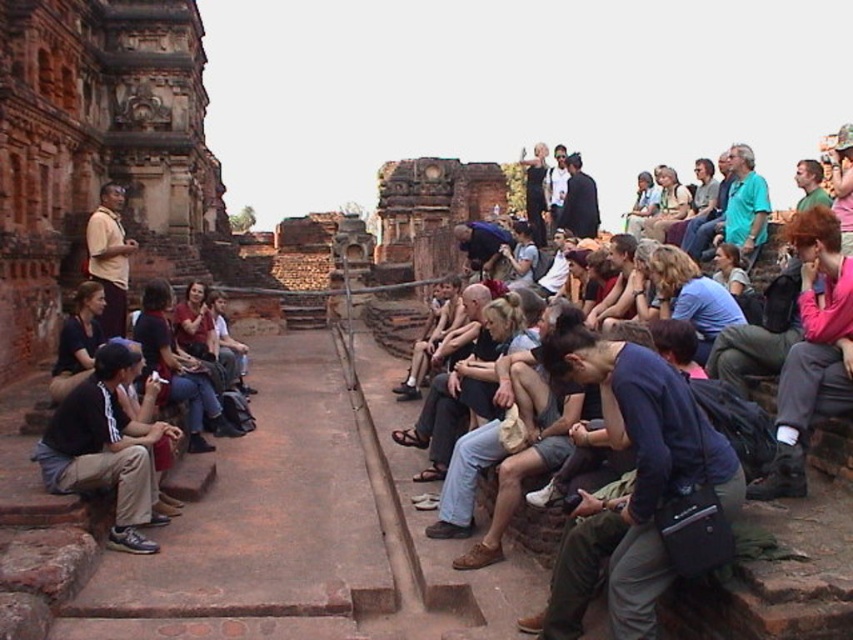
Does pink fabric jacket at right have a larger size compared to dark brown cotton pants at left?

Indeed, pink fabric jacket at right has a larger size compared to dark brown cotton pants at left.

Measure the distance between pink fabric jacket at right and dark brown cotton pants at left.

pink fabric jacket at right and dark brown cotton pants at left are 42.51 meters apart.

Is point (817, 307) less distant than point (151, 550)?

No, (817, 307) is further to viewer.

Identify the location of pink fabric jacket at right. (811, 349).

Is pink fabric jacket at right to the left of dark blue jeans at center from the viewer's perspective?

Incorrect, pink fabric jacket at right is not on the left side of dark blue jeans at center.

Is point (845, 385) positioned behind point (194, 444)?

No.

Where is `pink fabric jacket at right`? pink fabric jacket at right is located at coordinates (811, 349).

Which is in front, point (102, 464) or point (166, 378)?

Positioned in front is point (102, 464).

Between dark brown cotton pants at left and dark blue jeans at center, which one is positioned lower?

dark brown cotton pants at left is lower down.

This screenshot has width=853, height=640. Identify the location of dark brown cotton pants at left. (106, 449).

You are a GUI agent. You are given a task and a screenshot of the screen. Output one action in this format:
    pyautogui.click(x=<x>, y=<y>)
    Task: Click on the dark brown cotton pants at left
    Image resolution: width=853 pixels, height=640 pixels.
    Given the screenshot: What is the action you would take?
    click(x=106, y=449)